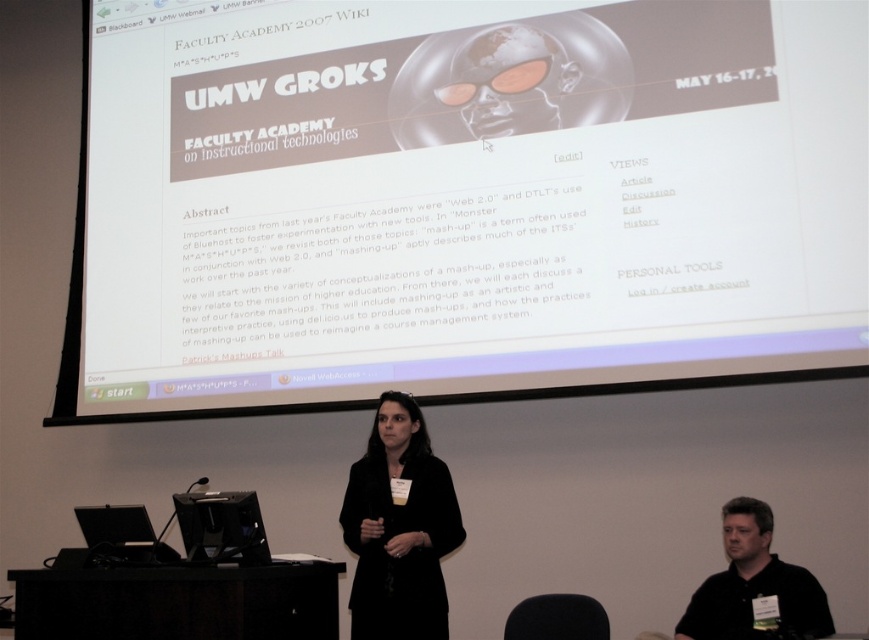
Question: Can you confirm if white matte projection screen at upper center is positioned to the left of black matte jacket at center?

Choices:
 (A) no
 (B) yes

Answer: (B)

Question: Which point is farther from the camera taking this photo?

Choices:
 (A) (708, 580)
 (B) (513, 225)
 (C) (459, 532)

Answer: (B)

Question: Which object is farther from the camera taking this photo?

Choices:
 (A) black matte jacket at center
 (B) black shirt at lower right

Answer: (A)

Question: Which point appears farthest from the camera in this image?

Choices:
 (A) (566, 324)
 (B) (383, 506)
 (C) (688, 618)

Answer: (A)

Question: Can you confirm if black matte jacket at center is positioned above black shirt at lower right?

Choices:
 (A) yes
 (B) no

Answer: (A)

Question: Considering the relative positions of white matte projection screen at upper center and black shirt at lower right in the image provided, where is white matte projection screen at upper center located with respect to black shirt at lower right?

Choices:
 (A) right
 (B) left

Answer: (B)